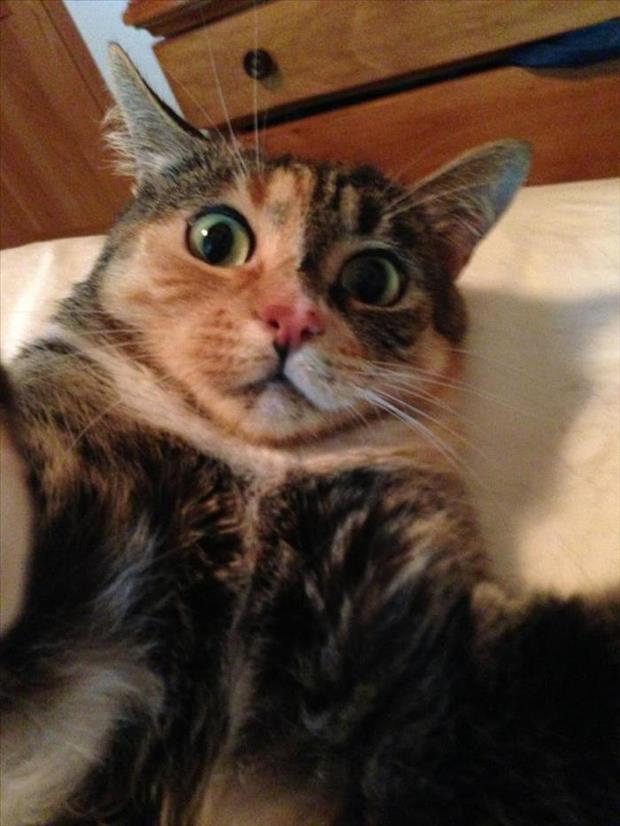
Locate an element on the screen. This screenshot has width=620, height=826. brown door is located at coordinates (60, 127).